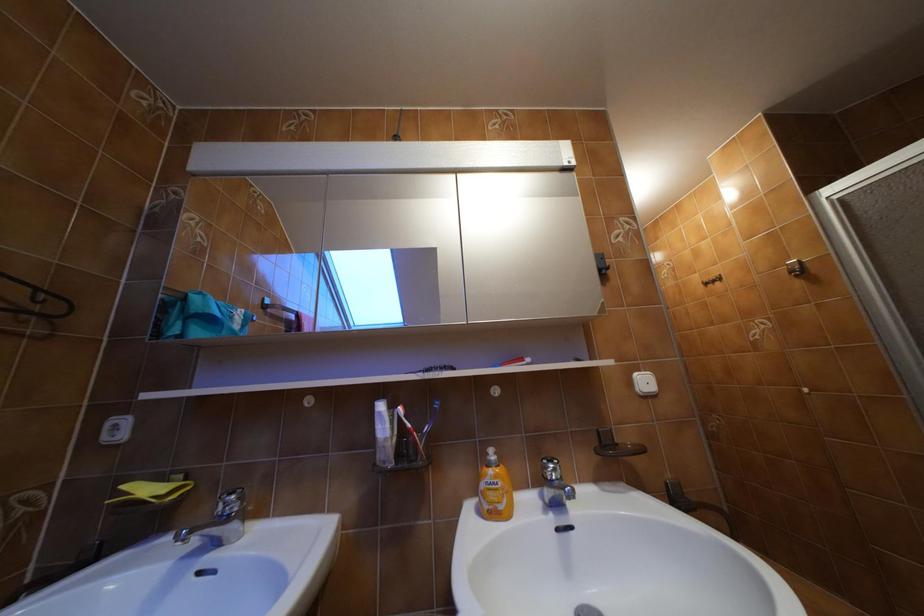
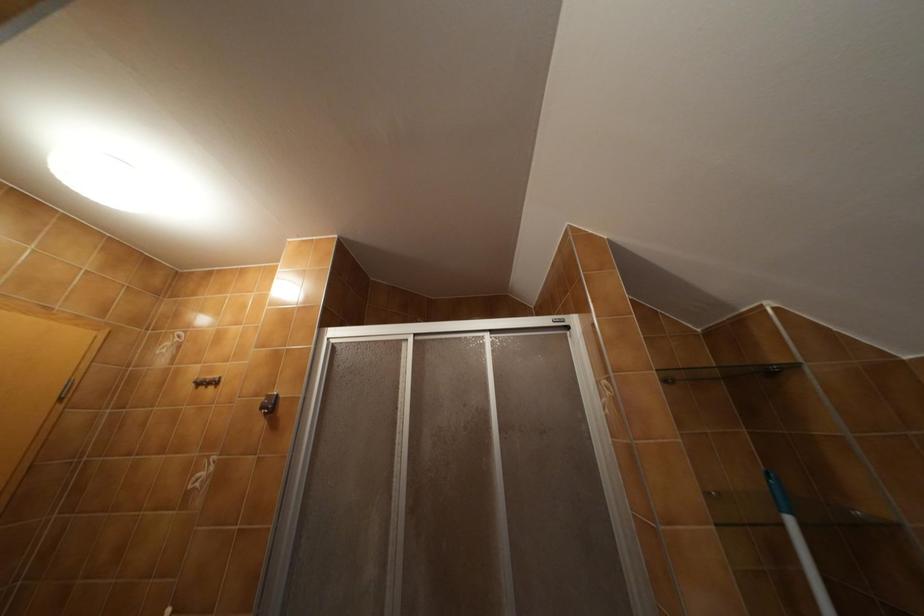
First-person continuous shooting, in which direction is the camera rotating?

The camera rotated toward right-up.